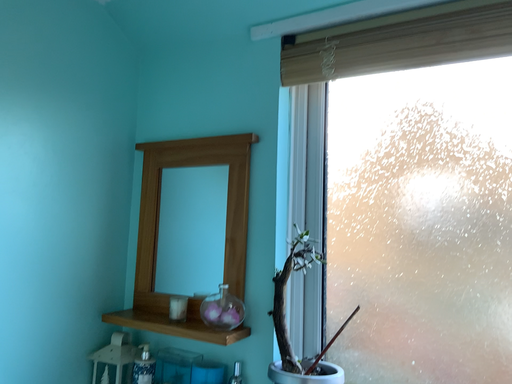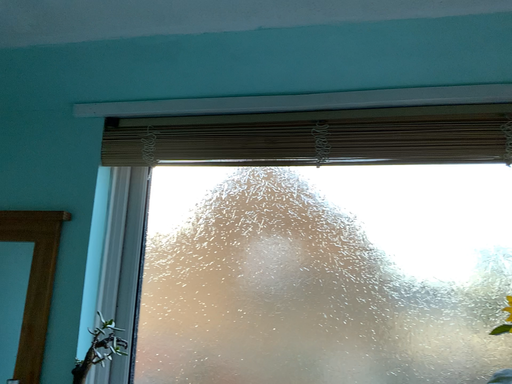
Question: How did the camera likely rotate when shooting the video?

Choices:
 (A) rotated right
 (B) rotated left

Answer: (A)